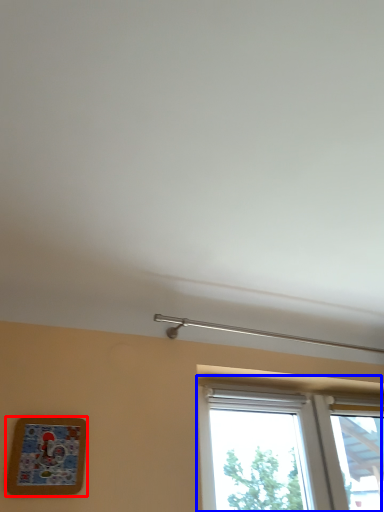
Question: Among these objects, which one is nearest to the camera, picture frame (highlighted by a red box) or window (highlighted by a blue box)?

Choices:
 (A) picture frame
 (B) window

Answer: (A)